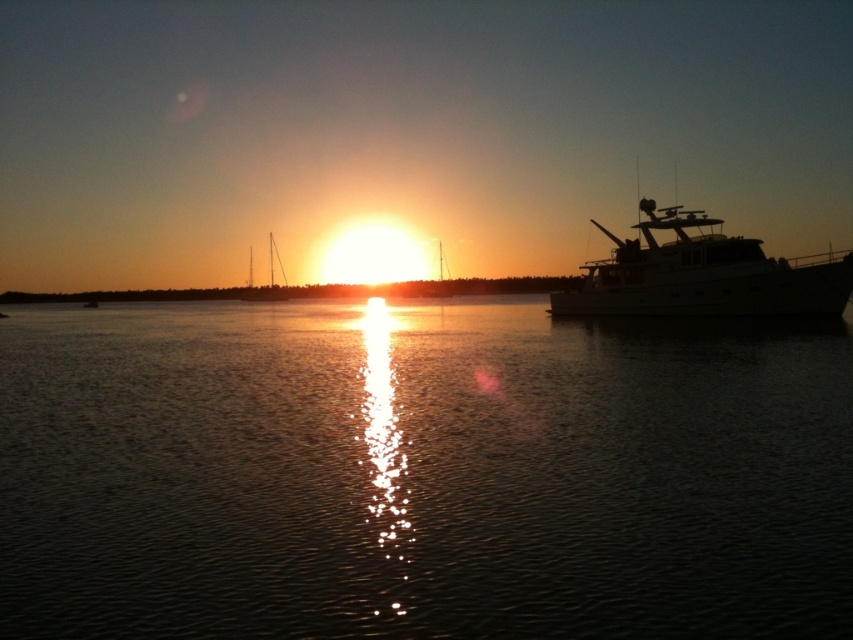
Does glistening water at center appear over white glossy boat at right?

Actually, glistening water at center is below white glossy boat at right.

Is the position of glistening water at center less distant than that of white glossy boat at right?

Yes.

Is point (212, 324) positioned before point (838, 273)?

That is False.

Where is `glistening water at center`? glistening water at center is located at coordinates (416, 476).